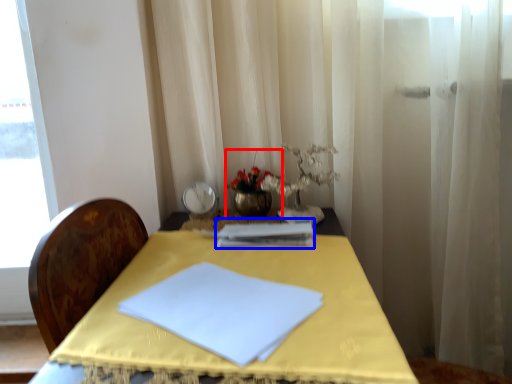
Question: Which point is further to the camera, floral arrangement (highlighted by a red box) or journal (highlighted by a blue box)?

Choices:
 (A) floral arrangement
 (B) journal

Answer: (A)